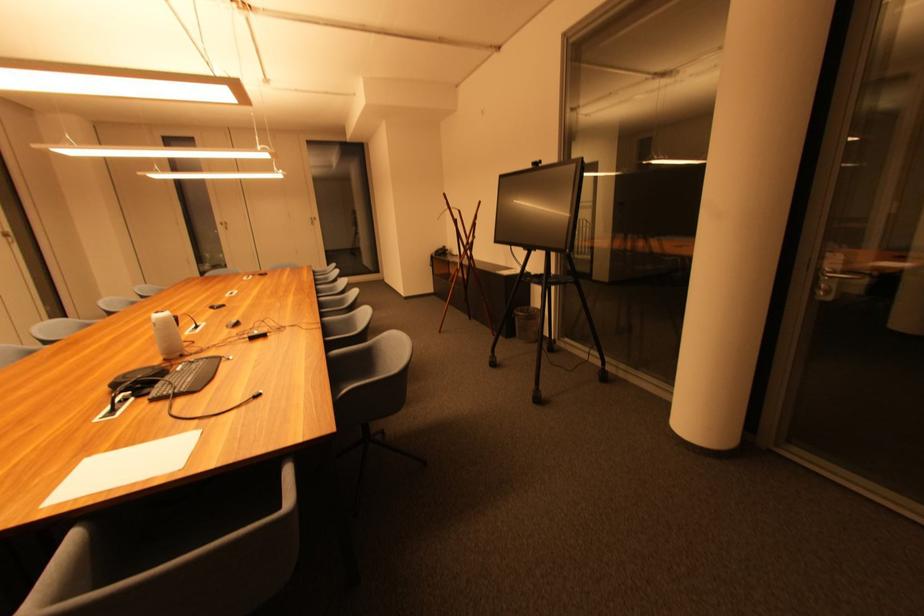
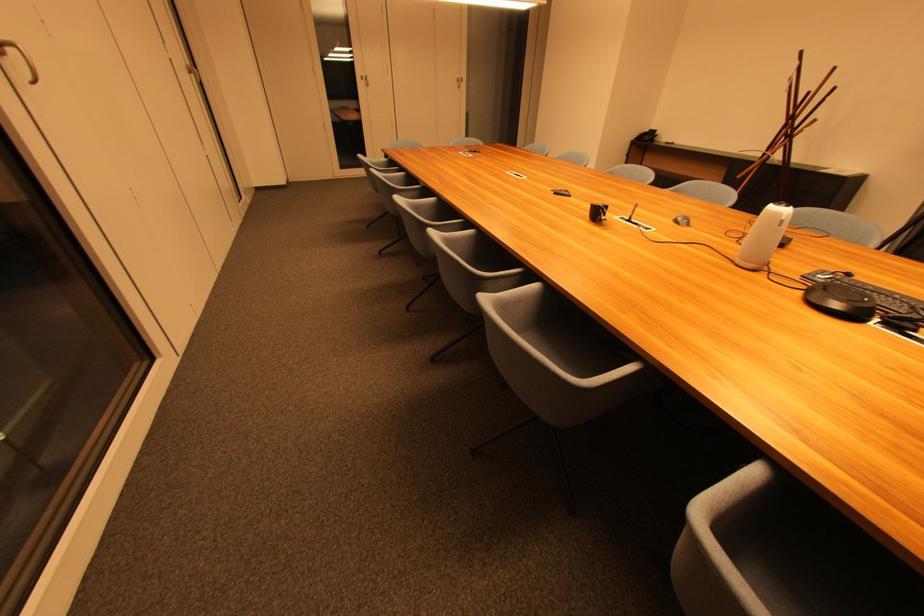
Question: The images are taken continuously from a first-person perspective. In which direction are you moving?

Choices:
 (A) Left
 (B) Right
 (C) Forward
 (D) Backward

Answer: (A)